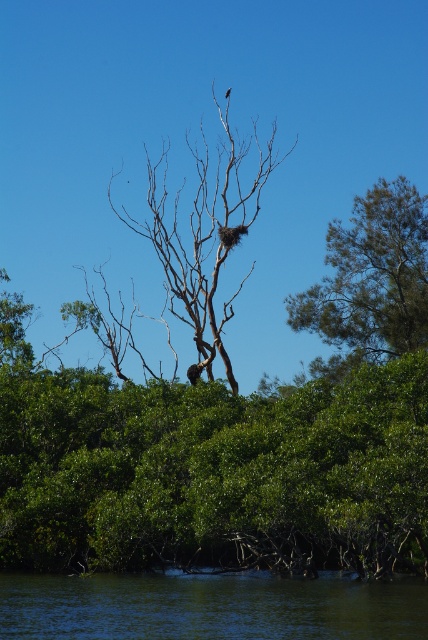
Which is more to the right, green leafy tree at upper right or brown feathered bird at upper center?

From the viewer's perspective, green leafy tree at upper right appears more on the right side.

Is green leafy tree at upper right above brown feathered bird at upper center?

Actually, green leafy tree at upper right is below brown feathered bird at upper center.

You are a GUI agent. You are given a task and a screenshot of the screen. Output one action in this format:
    pyautogui.click(x=<x>, y=<y>)
    Task: Click on the green leafy tree at upper right
    
    Given the screenshot: What is the action you would take?
    pyautogui.click(x=371, y=280)

Between point (154, 195) and point (425, 228), which one is positioned in front?

Positioned in front is point (425, 228).

Is point (243, 147) less distant than point (394, 321)?

No, it is behind (394, 321).

The height and width of the screenshot is (640, 428). I want to click on bare wood tree at upper center, so click(x=204, y=236).

What do you see at coordinates (204, 236) in the screenshot? The height and width of the screenshot is (640, 428). I see `bare wood tree at upper center` at bounding box center [204, 236].

Between bare wood tree at upper center and brown feathered bird at upper center, which one is positioned higher?

brown feathered bird at upper center is above.

Who is more forward, (171,262) or (225,97)?

Point (171,262) is more forward.

The width and height of the screenshot is (428, 640). What are the coordinates of `bare wood tree at upper center` in the screenshot? It's located at (204, 236).